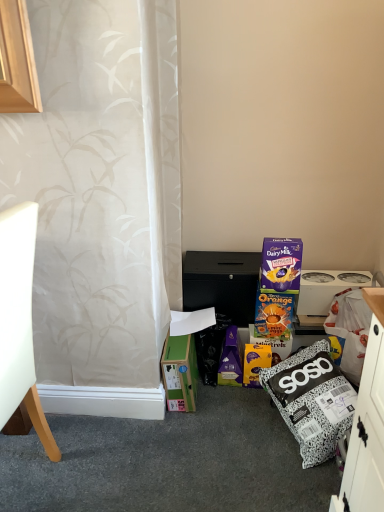
The height and width of the screenshot is (512, 384). Describe the element at coordinates (326, 288) in the screenshot. I see `white plastic appliance at right` at that location.

This screenshot has width=384, height=512. What do you see at coordinates (19, 322) in the screenshot?
I see `white matte chair at left` at bounding box center [19, 322].

The width and height of the screenshot is (384, 512). Identify the location of black matte cabinet at center. (221, 283).

From a real-world perspective, is white plastic appliance at right below green cardboard box at lower left?

No.

Where is `box on the left of the white plastic appliance at right`? box on the left of the white plastic appliance at right is located at coordinates (180, 372).

In terms of height, does white plastic appliance at right look taller or shorter compared to green cardboard box at lower left?

Considering their sizes, white plastic appliance at right has less height than green cardboard box at lower left.

Would you say black matte cabinet at center is outside white matte chair at left?

Answer: Indeed, black matte cabinet at center is completely outside white matte chair at left.

Is black matte cabinet at center in contact with white matte chair at left?

They are not placed beside each other.

Between point (237, 317) and point (40, 438), which one is positioned behind?

Point (237, 317)

This screenshot has height=512, width=384. In order to click on cabinetry that is under the white matte chair at left (from a real-world perspective) in this screenshot , I will do `click(221, 283)`.

What's the angular difference between black matte cabinet at center and white plastic appliance at right's facing directions?

There is a 0.00588-degree angle between the facing directions of black matte cabinet at center and white plastic appliance at right.

Can you see black matte cabinet at center touching white plastic appliance at right?

There is a gap between black matte cabinet at center and white plastic appliance at right.

Which of these two, black matte cabinet at center or white plastic appliance at right, stands shorter?

white plastic appliance at right.

Visually, is black matte cabinet at center positioned to the left or to the right of white plastic appliance at right?

black matte cabinet at center is to the left of white plastic appliance at right.

Based on the photo, which of these two, white plastic appliance at right or black matte cabinet at center, is thinner?

white plastic appliance at right.

Is white plastic appliance at right closer to the viewer compared to black matte cabinet at center?

No, white plastic appliance at right is further to the viewer.

Would you say white plastic appliance at right contains black matte cabinet at center?

Actually, black matte cabinet at center is outside white plastic appliance at right.

Which of these two, black matte cabinet at center or green cardboard box at lower left, stands shorter?

Standing shorter between the two is black matte cabinet at center.

Is black matte cabinet at center in front of green cardboard box at lower left?

No, it is not.

Is point (254, 290) closer to viewer compared to point (174, 356)?

No, (254, 290) is further to viewer.

From the image's perspective, is black matte cabinet at center under green cardboard box at lower left?

Incorrect, from the image's perspective, black matte cabinet at center is higher than green cardboard box at lower left.

Can you confirm if green cardboard box at lower left is thinner than black matte cabinet at center?

Yes, green cardboard box at lower left is thinner than black matte cabinet at center.

Is green cardboard box at lower left located outside black matte cabinet at center?

Yes.

In the scene shown: Which of these two, green cardboard box at lower left or black matte cabinet at center, stands shorter?

Standing shorter between the two is black matte cabinet at center.

Is the position of green cardboard box at lower left less distant than that of black matte cabinet at center?

Yes, green cardboard box at lower left is closer to the viewer.

Is white matte chair at left beside black matte cabinet at center?

white matte chair at left and black matte cabinet at center are not in contact.

Could black matte cabinet at center be considered to be inside white matte chair at left?

No, black matte cabinet at center is not surrounded by white matte chair at left.

Which of these two, white matte chair at left or black matte cabinet at center, stands taller?

white matte chair at left is taller.

Who is more distant, white matte chair at left or black matte cabinet at center?

Positioned behind is black matte cabinet at center.

Image resolution: width=384 pixels, height=512 pixels. In order to click on appliance that appears above the green cardboard box at lower left (from a real-world perspective) in this screenshot , I will do `click(326, 288)`.

This screenshot has height=512, width=384. In order to click on cabinetry that appears on the right of white matte chair at left in this screenshot , I will do `click(221, 283)`.

When comparing their distances from white matte chair at left, does green cardboard box at lower left or white plastic appliance at right seem closer?

green cardboard box at lower left is positioned closer to the anchor white matte chair at left.

Which object lies further to the anchor point white plastic appliance at right, white matte chair at left or green cardboard box at lower left?

The object further to white plastic appliance at right is white matte chair at left.

Looking at the image, which one is located further to white matte chair at left, black matte cabinet at center or white plastic appliance at right?

Among the two, white plastic appliance at right is located further to white matte chair at left.

Based on their spatial positions, is black matte cabinet at center or white plastic appliance at right further from green cardboard box at lower left?

Based on the image, white plastic appliance at right appears to be further to green cardboard box at lower left.

Considering their positions, is white plastic appliance at right positioned further to white matte chair at left than green cardboard box at lower left?

Based on the image, white plastic appliance at right appears to be further to white matte chair at left.

When comparing their distances from white plastic appliance at right, does green cardboard box at lower left or black matte cabinet at center seem closer?

The object closer to white plastic appliance at right is black matte cabinet at center.

When comparing their distances from black matte cabinet at center, does white plastic appliance at right or green cardboard box at lower left seem further?

The object further to black matte cabinet at center is white plastic appliance at right.

When comparing their distances from black matte cabinet at center, does white matte chair at left or white plastic appliance at right seem further?

white matte chair at left lies further to black matte cabinet at center than the other object.

This screenshot has width=384, height=512. I want to click on cabinetry located between white matte chair at left and white plastic appliance at right in the depth direction, so click(x=221, y=283).

The width and height of the screenshot is (384, 512). In order to click on cabinetry located between green cardboard box at lower left and white plastic appliance at right in the left-right direction in this screenshot , I will do `click(221, 283)`.

The width and height of the screenshot is (384, 512). I want to click on box located between white matte chair at left and white plastic appliance at right in the left-right direction, so click(x=180, y=372).

In order to click on box between white matte chair at left and black matte cabinet at center in the front-back direction in this screenshot , I will do `click(180, 372)`.